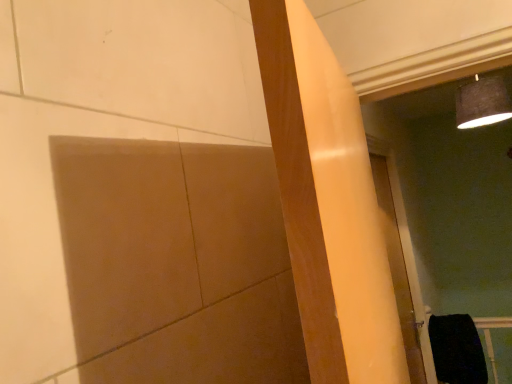
The image size is (512, 384). What do you see at coordinates (398, 269) in the screenshot?
I see `white glossy door at right` at bounding box center [398, 269].

Where is `white glossy door at right`? The image size is (512, 384). white glossy door at right is located at coordinates (398, 269).

You are a GUI agent. You are given a task and a screenshot of the screen. Output one action in this format:
    pyautogui.click(x=<x>, y=<y>)
    Task: Click on the black fabric at lower right
    
    Given the screenshot: What is the action you would take?
    pyautogui.click(x=457, y=350)

Describe the element at coordinates (457, 350) in the screenshot. I see `black fabric at lower right` at that location.

The image size is (512, 384). Identify the location of white glossy door at right. (398, 269).

Consider the image. Between black fabric at lower right and white glossy door at right, which one appears on the left side from the viewer's perspective?

white glossy door at right is more to the left.

Consider the image. Does black fabric at lower right lie in front of white glossy door at right?

No, the depth of black fabric at lower right is greater than that of white glossy door at right.

Which is nearer, (453, 365) or (387, 183)?

Point (453, 365) is farther from the camera than point (387, 183).

From the image's perspective, is black fabric at lower right below white glossy door at right?

Correct, black fabric at lower right appears lower than white glossy door at right in the image.

Based on the photo, from a real-world perspective, does black fabric at lower right stand above white glossy door at right?

No, from a real-world perspective, black fabric at lower right is not over white glossy door at right

Between black fabric at lower right and white glossy door at right, which one has larger width?

black fabric at lower right is wider.

Considering the relative sizes of black fabric at lower right and white glossy door at right in the image provided, is black fabric at lower right taller than white glossy door at right?

In fact, black fabric at lower right may be shorter than white glossy door at right.

Considering the relative sizes of black fabric at lower right and white glossy door at right in the image provided, is black fabric at lower right smaller than white glossy door at right?

Yes.

Is black fabric at lower right inside the boundaries of white glossy door at right, or outside?

black fabric at lower right cannot be found inside white glossy door at right.

Is black fabric at lower right next to white glossy door at right?

They are not placed beside each other.

Is black fabric at lower right positioned with its back to white glossy door at right?

No, black fabric at lower right's orientation is not away from white glossy door at right.

Can you tell me how much black fabric at lower right and white glossy door at right differ in facing direction?

There is a 93.8-degree angle between the facing directions of black fabric at lower right and white glossy door at right.

At what (x,y) coordinates should I click in order to perform the action: click on door on the left of black fabric at lower right. Please return your answer as a coordinate pair (x, y). Looking at the image, I should click on (398, 269).

Considering the relative positions of white glossy door at right and black fabric at lower right in the image provided, is white glossy door at right to the right of black fabric at lower right from the viewer's perspective?

In fact, white glossy door at right is to the left of black fabric at lower right.

Who is more distant, white glossy door at right or black fabric at lower right?

black fabric at lower right is further from the camera.

Considering the points (422, 359) and (468, 370), which point is in front, point (422, 359) or point (468, 370)?

The point (422, 359) is closer to the camera.

From the image's perspective, which is below, white glossy door at right or black fabric at lower right?

black fabric at lower right appears lower in the image.

From a real-world perspective, which object rests below the other?

black fabric at lower right is physically lower.

Is white glossy door at right wider or thinner than black fabric at lower right?

Considering their sizes, white glossy door at right looks slimmer than black fabric at lower right.

Considering the sizes of objects white glossy door at right and black fabric at lower right in the image provided, who is shorter, white glossy door at right or black fabric at lower right?

With less height is black fabric at lower right.

Considering the sizes of objects white glossy door at right and black fabric at lower right in the image provided, who is bigger, white glossy door at right or black fabric at lower right?

With larger size is white glossy door at right.

Is white glossy door at right located outside black fabric at lower right?

Yes, white glossy door at right is outside of black fabric at lower right.

Are white glossy door at right and black fabric at lower right making contact?

No.

Could you tell me if white glossy door at right is facing black fabric at lower right?

No, white glossy door at right is not turned towards black fabric at lower right.

How different are the orientations of white glossy door at right and black fabric at lower right in degrees?

They differ by 93.8 degrees in their facing directions.

At what (x,y) coordinates should I click in order to perform the action: click on door located above the black fabric at lower right (from the image's perspective). Please return your answer as a coordinate pair (x, y). Looking at the image, I should click on (398, 269).

I want to click on material beneath the white glossy door at right (from a real-world perspective), so click(x=457, y=350).

This screenshot has height=384, width=512. What are the coordinates of `door located above the black fabric at lower right (from a real-world perspective)` in the screenshot? It's located at (398, 269).